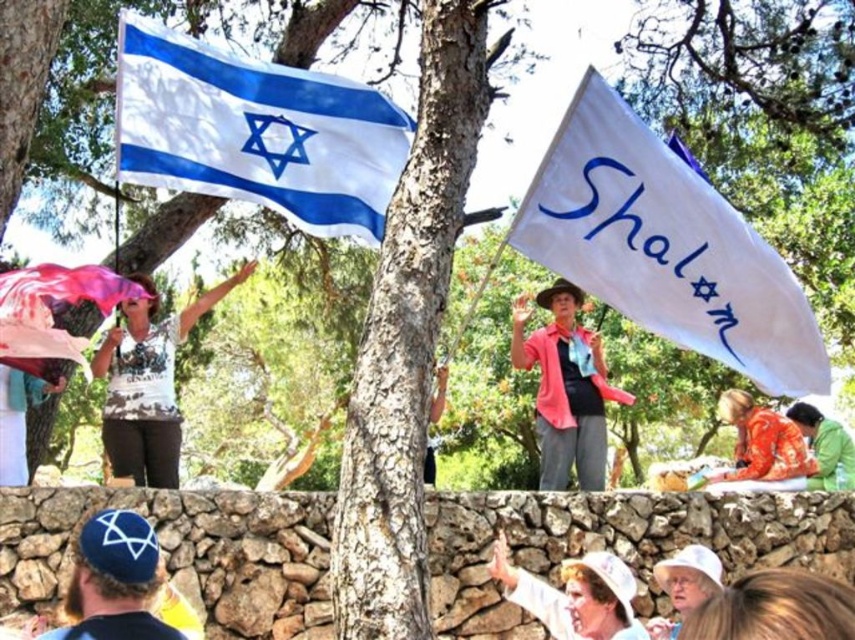
Can you confirm if white fabric flag at upper left is positioned to the right of orange fabric at lower right?

In fact, white fabric flag at upper left is to the left of orange fabric at lower right.

Can you confirm if white fabric flag at upper left is taller than orange fabric at lower right?

Yes, white fabric flag at upper left is taller than orange fabric at lower right.

This screenshot has width=855, height=640. Find the location of `white fabric flag at upper left`. white fabric flag at upper left is located at coordinates (255, 131).

This screenshot has height=640, width=855. I want to click on white fabric flag at upper left, so click(x=255, y=131).

From the picture: Is white fabric flag at center below blue fabric kippah at lower left?

Actually, white fabric flag at center is above blue fabric kippah at lower left.

Which is in front, point (756, 348) or point (96, 612)?

Point (96, 612) is in front.

Locate an element on the screen. The image size is (855, 640). white fabric flag at center is located at coordinates (665, 246).

Who is positioned more to the right, white fabric flag at upper left or blue fabric kippah at lower left?

From the viewer's perspective, white fabric flag at upper left appears more on the right side.

Which is behind, point (115, 157) or point (109, 598)?

Point (115, 157)

Which is in front, point (222, 60) or point (71, 630)?

Point (71, 630) is more forward.

The image size is (855, 640). Identify the location of white fabric flag at upper left. (255, 131).